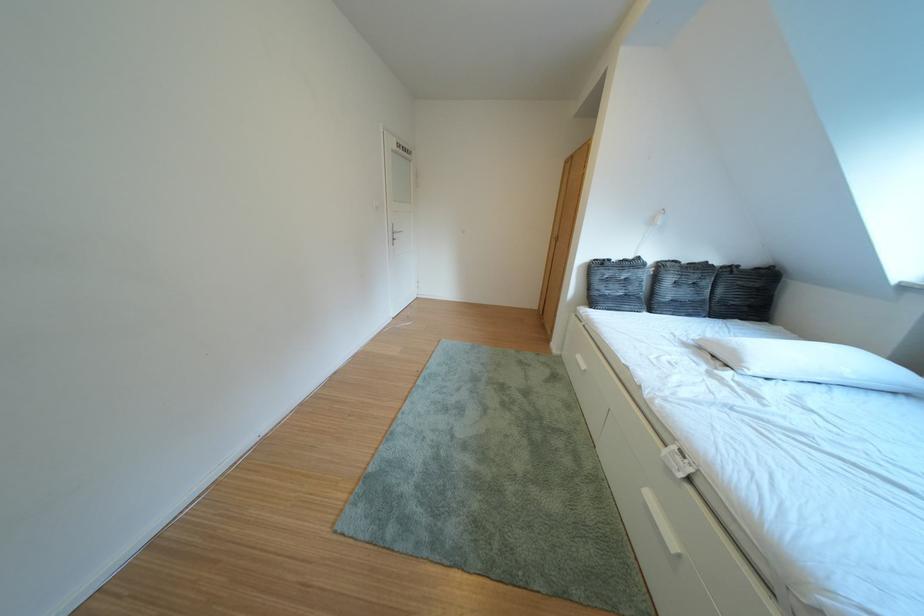
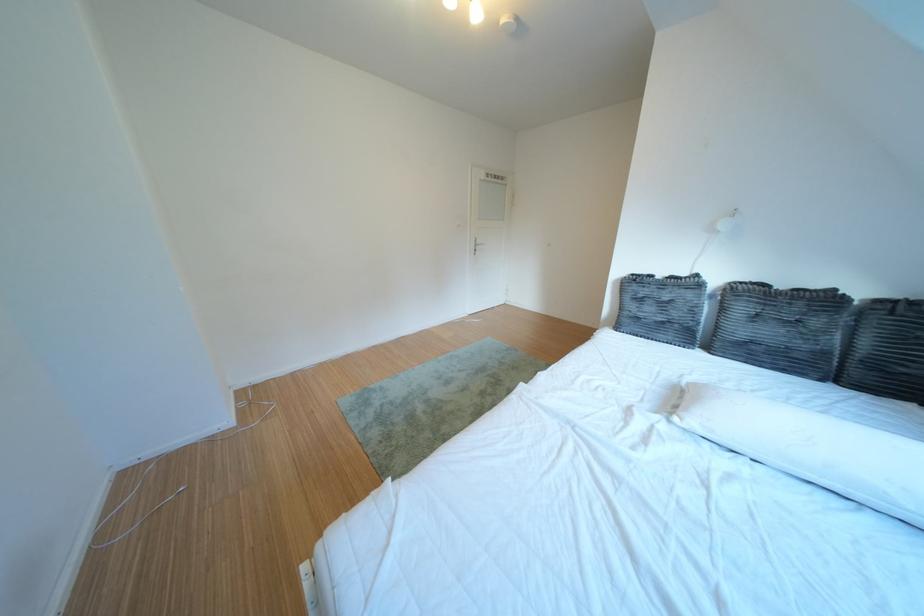
Locate, in the second image, the point that corresponds to point 745,272 in the first image.

(910, 306)